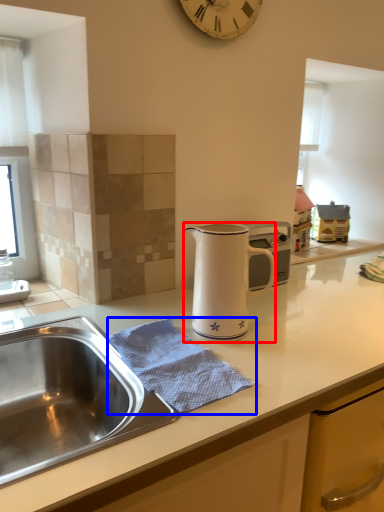
Question: Which object is closer to the camera taking this photo, jug (highlighted by a red box) or blanket (highlighted by a blue box)?

Choices:
 (A) jug
 (B) blanket

Answer: (B)